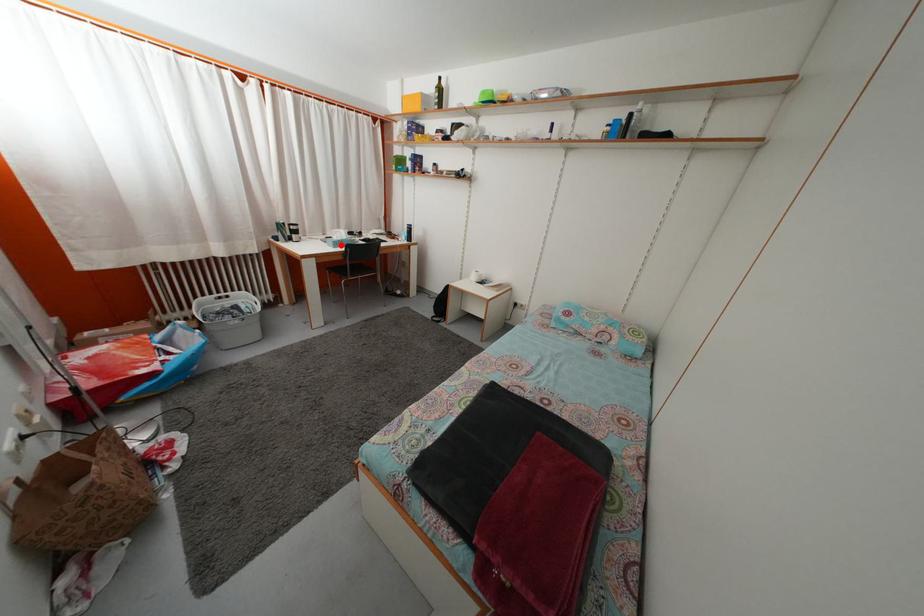
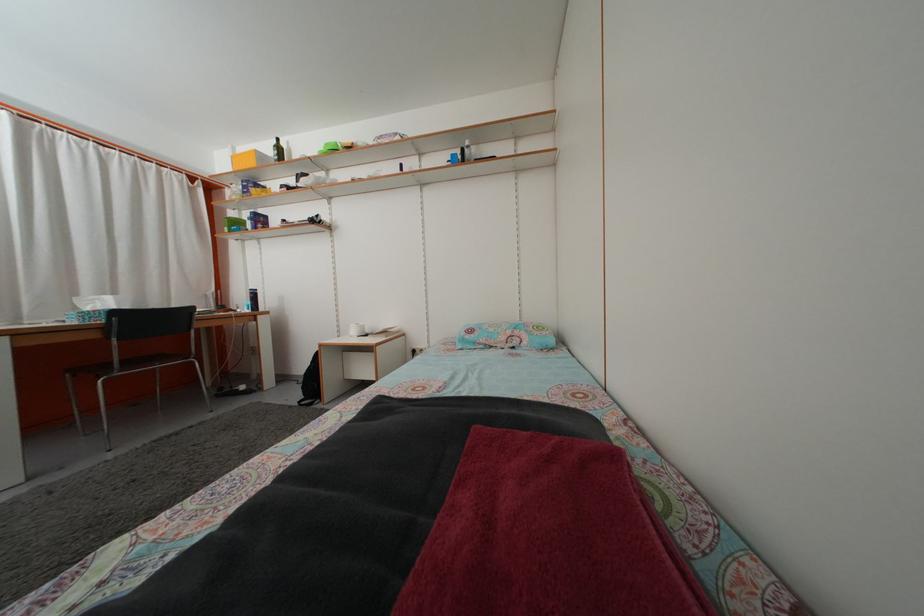
Question: I am providing you with two images of the same scene from different viewpoints. Image1 has a red point marked. In image2, the corresponding 3D location appears at what relative position? Reply with the corresponding letter.

Choices:
 (A) Closer
 (B) Farther

Answer: (B)